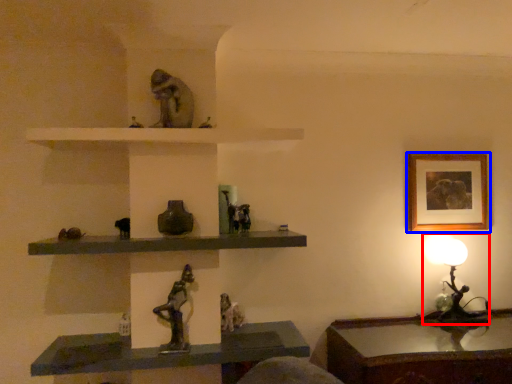
Question: Which of the following is the farthest to the observer, table lamp (highlighted by a red box) or picture frame (highlighted by a blue box)?

Choices:
 (A) table lamp
 (B) picture frame

Answer: (B)